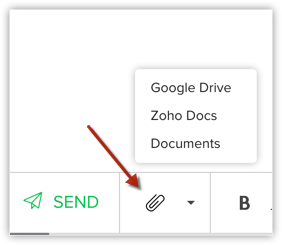
Locate an element on the screen. This screenshot has width=282, height=245. documents is located at coordinates (168, 143).